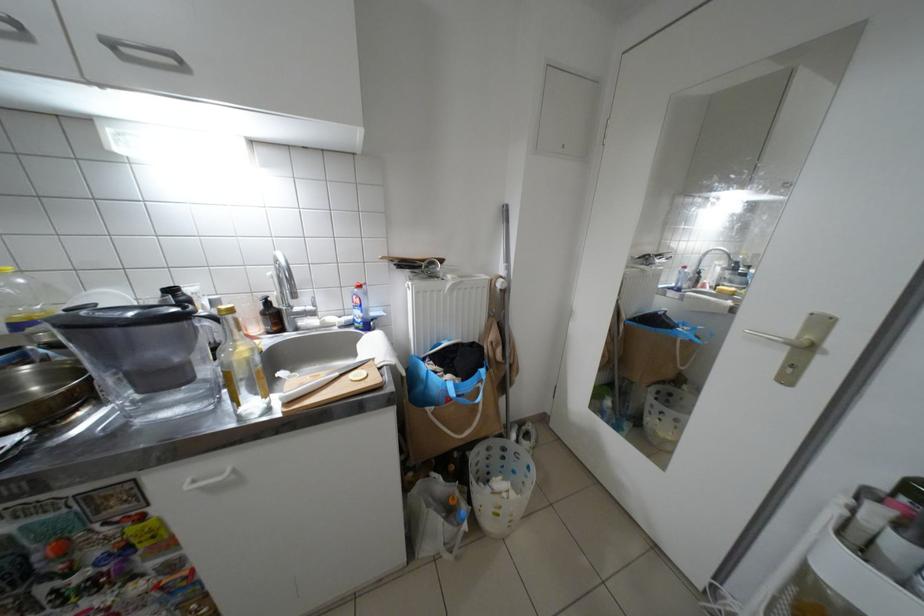
The width and height of the screenshot is (924, 616). In order to click on water pitcher handle in this screenshot , I will do `click(127, 313)`.